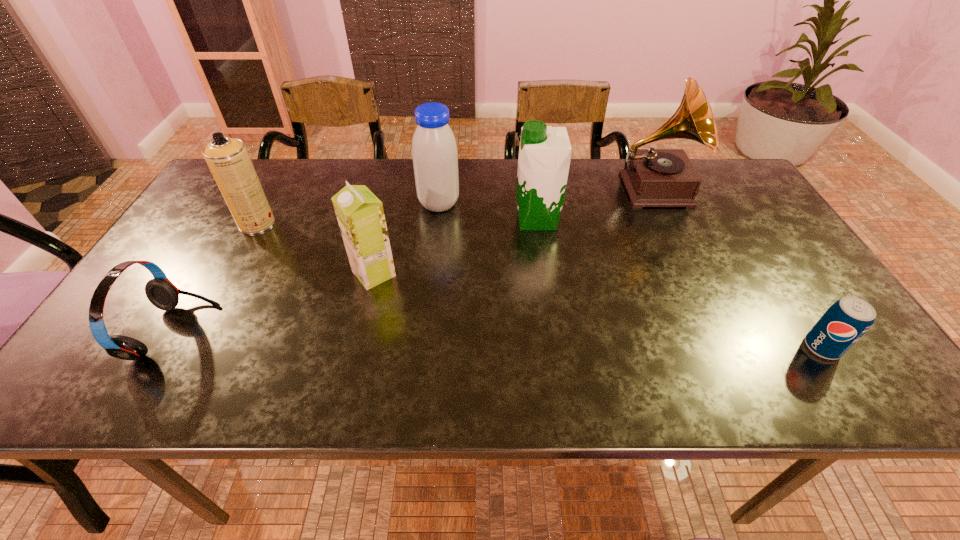
You are a GUI agent. You are given a task and a screenshot of the screen. Output one action in this format:
    pyautogui.click(x=<x>, y=<y>)
    Task: Click on the free region at the left edge
    
    Given the screenshot: What is the action you would take?
    pyautogui.click(x=212, y=236)

I want to click on vacant space at the far left corner of the desktop, so click(x=283, y=160).

This screenshot has width=960, height=540. I want to click on vacant space at the near left corner, so click(x=144, y=367).

This screenshot has height=540, width=960. I want to click on vacant area at the far right corner, so click(x=728, y=167).

The image size is (960, 540). Find the location of `free space between the leftmost soya milk and the sixth object from left to right`. free space between the leftmost soya milk and the sixth object from left to right is located at coordinates (514, 232).

You are a GUI agent. You are given a task and a screenshot of the screen. Output one action in this format:
    pyautogui.click(x=<x>, y=<y>)
    Task: Click on the empty space between the aerosol can and the pop
    This screenshot has height=540, width=960.
    Given the screenshot: What is the action you would take?
    pyautogui.click(x=540, y=285)

The image size is (960, 540). What are the coordinates of `free area in between the second soya milk from right to left and the fifth object from right to left` in the screenshot? It's located at (406, 239).

Find the location of `vacant space that's between the phonograph record and the rightmost object`. vacant space that's between the phonograph record and the rightmost object is located at coordinates (737, 268).

Locate an element on the screen. Image resolution: width=960 pixels, height=540 pixels. free area in between the nearest soya milk and the rightmost soya milk is located at coordinates (455, 247).

Where is `unoccupied position between the rightmost object and the sixth tallest object`? The height and width of the screenshot is (540, 960). unoccupied position between the rightmost object and the sixth tallest object is located at coordinates (498, 340).